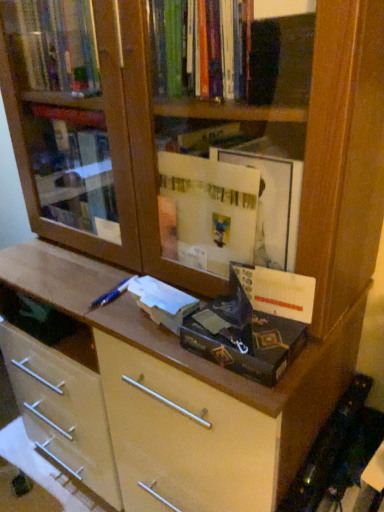
Identify the location of white matte paper at center, which appears as the first paperback book when viewed from the left. (162, 302).

Consider the image. What is the approximate height of white matte paper at center, the second paperback book positioned from the right?

white matte paper at center, the second paperback book positioned from the right, is 2.86 inches tall.

What do you see at coordinates (162, 302) in the screenshot? The image size is (384, 512). I see `white matte paper at center, the second paperback book positioned from the right` at bounding box center [162, 302].

This screenshot has width=384, height=512. What do you see at coordinates (249, 327) in the screenshot?
I see `matte cardboard paperback book at center, the 2th paperback book viewed from the left` at bounding box center [249, 327].

Where is `matte cardboard paperback book at center, the 2th paperback book viewed from the left`? The width and height of the screenshot is (384, 512). matte cardboard paperback book at center, the 2th paperback book viewed from the left is located at coordinates (249, 327).

Measure the distance between point (297,325) and camera.

Point (297,325) is 31.22 inches away from camera.

Locate an element on the screen. white matte paper at center, which appears as the first paperback book when viewed from the left is located at coordinates point(162,302).

Between white matte paper at center, which appears as the first paperback book when viewed from the left, and matte cardboard paperback book at center, arranged as the 1th paperback book when viewed from the right, which one appears on the left side from the viewer's perspective?

Positioned to the left is white matte paper at center, which appears as the first paperback book when viewed from the left.

Which object is further away from the camera, white matte paper at center, the second paperback book positioned from the right, or matte cardboard paperback book at center, the 2th paperback book viewed from the left?

white matte paper at center, the second paperback book positioned from the right, is more distant.

Which is less distant, (152, 290) or (233, 339)?

The point (233, 339) is more forward.

From the image's perspective, is white matte paper at center, which appears as the first paperback book when viewed from the left, located above or below matte cardboard paperback book at center, arranged as the 1th paperback book when viewed from the right?

white matte paper at center, which appears as the first paperback book when viewed from the left, is below matte cardboard paperback book at center, arranged as the 1th paperback book when viewed from the right.

From a real-world perspective, which object stands above the other?

matte cardboard paperback book at center, the 2th paperback book viewed from the left, from a real-world perspective.

Does white matte paper at center, which appears as the first paperback book when viewed from the left, have a greater width compared to matte cardboard paperback book at center, arranged as the 1th paperback book when viewed from the right?

Incorrect, the width of white matte paper at center, which appears as the first paperback book when viewed from the left, does not surpass that of matte cardboard paperback book at center, arranged as the 1th paperback book when viewed from the right.

Considering the relative sizes of white matte paper at center, the second paperback book positioned from the right, and matte cardboard paperback book at center, arranged as the 1th paperback book when viewed from the right, in the image provided, is white matte paper at center, the second paperback book positioned from the right, shorter than matte cardboard paperback book at center, arranged as the 1th paperback book when viewed from the right,?

Correct, white matte paper at center, the second paperback book positioned from the right, is not as tall as matte cardboard paperback book at center, arranged as the 1th paperback book when viewed from the right.

Considering the sizes of objects white matte paper at center, which appears as the first paperback book when viewed from the left, and matte cardboard paperback book at center, arranged as the 1th paperback book when viewed from the right, in the image provided, who is smaller, white matte paper at center, which appears as the first paperback book when viewed from the left, or matte cardboard paperback book at center, arranged as the 1th paperback book when viewed from the right,?

Smaller between the two is white matte paper at center, which appears as the first paperback book when viewed from the left.

Could matte cardboard paperback book at center, the 2th paperback book viewed from the left, be considered to be inside white matte paper at center, which appears as the first paperback book when viewed from the left?

No, matte cardboard paperback book at center, the 2th paperback book viewed from the left, is located outside of white matte paper at center, which appears as the first paperback book when viewed from the left.

Is white matte paper at center, which appears as the first paperback book when viewed from the left, far away from matte cardboard paperback book at center, the 2th paperback book viewed from the left?

Actually, white matte paper at center, which appears as the first paperback book when viewed from the left, and matte cardboard paperback book at center, the 2th paperback book viewed from the left, are a little close together.

Is white matte paper at center, the second paperback book positioned from the right, looking in the opposite direction of matte cardboard paperback book at center, arranged as the 1th paperback book when viewed from the right?

No, white matte paper at center, the second paperback book positioned from the right, is not facing away from matte cardboard paperback book at center, arranged as the 1th paperback book when viewed from the right.

How different are the orientations of white matte paper at center, which appears as the first paperback book when viewed from the left, and matte cardboard paperback book at center, the 2th paperback book viewed from the left, in degrees?

The angular difference between white matte paper at center, which appears as the first paperback book when viewed from the left, and matte cardboard paperback book at center, the 2th paperback book viewed from the left, is 15.8 degrees.

Locate an element on the screen. Image resolution: width=384 pixels, height=512 pixels. paperback book that is on the left side of matte cardboard paperback book at center, the 2th paperback book viewed from the left is located at coordinates (162, 302).

Can you confirm if matte cardboard paperback book at center, arranged as the 1th paperback book when viewed from the right, is positioned to the left of white matte paper at center, which appears as the first paperback book when viewed from the left?

In fact, matte cardboard paperback book at center, arranged as the 1th paperback book when viewed from the right, is to the right of white matte paper at center, which appears as the first paperback book when viewed from the left.

Is the position of matte cardboard paperback book at center, arranged as the 1th paperback book when viewed from the right, more distant than that of white matte paper at center, which appears as the first paperback book when viewed from the left?

No, it is not.

Which is farther, (231, 265) or (164, 284)?

The point (164, 284) is behind.

From the image's perspective, which one is positioned higher, matte cardboard paperback book at center, arranged as the 1th paperback book when viewed from the right, or white matte paper at center, the second paperback book positioned from the right?

From the image's view, matte cardboard paperback book at center, arranged as the 1th paperback book when viewed from the right, is above.

From a real-world perspective, who is located higher, matte cardboard paperback book at center, the 2th paperback book viewed from the left, or white matte paper at center, which appears as the first paperback book when viewed from the left?

matte cardboard paperback book at center, the 2th paperback book viewed from the left.

Considering the sizes of matte cardboard paperback book at center, the 2th paperback book viewed from the left, and white matte paper at center, which appears as the first paperback book when viewed from the left, in the image, is matte cardboard paperback book at center, the 2th paperback book viewed from the left, wider or thinner than white matte paper at center, which appears as the first paperback book when viewed from the left,?

In the image, matte cardboard paperback book at center, the 2th paperback book viewed from the left, appears to be wider than white matte paper at center, which appears as the first paperback book when viewed from the left.

Considering the sizes of objects matte cardboard paperback book at center, the 2th paperback book viewed from the left, and white matte paper at center, the second paperback book positioned from the right, in the image provided, who is taller, matte cardboard paperback book at center, the 2th paperback book viewed from the left, or white matte paper at center, the second paperback book positioned from the right,?

matte cardboard paperback book at center, the 2th paperback book viewed from the left.

Does matte cardboard paperback book at center, the 2th paperback book viewed from the left, have a larger size compared to white matte paper at center, which appears as the first paperback book when viewed from the left?

A: Correct, matte cardboard paperback book at center, the 2th paperback book viewed from the left, is larger in size than white matte paper at center, which appears as the first paperback book when viewed from the left.

Is white matte paper at center, the second paperback book positioned from the right, a part of matte cardboard paperback book at center, the 2th paperback book viewed from the left?

Actually, white matte paper at center, the second paperback book positioned from the right, is outside matte cardboard paperback book at center, the 2th paperback book viewed from the left.

Is matte cardboard paperback book at center, the 2th paperback book viewed from the left, next to white matte paper at center, the second paperback book positioned from the right?

No, matte cardboard paperback book at center, the 2th paperback book viewed from the left, is not in contact with white matte paper at center, the second paperback book positioned from the right.

Is matte cardboard paperback book at center, arranged as the 1th paperback book when viewed from the right, facing away from white matte paper at center, the second paperback book positioned from the right?

No.

Measure the distance between matte cardboard paperback book at center, the 2th paperback book viewed from the left, and white matte paper at center, which appears as the first paperback book when viewed from the left.

matte cardboard paperback book at center, the 2th paperback book viewed from the left, is 4.44 inches away from white matte paper at center, which appears as the first paperback book when viewed from the left.

I want to click on paperback book below the matte cardboard paperback book at center, the 2th paperback book viewed from the left (from a real-world perspective), so click(x=162, y=302).

Locate an element on the screen. paperback book beneath the matte cardboard paperback book at center, the 2th paperback book viewed from the left (from a real-world perspective) is located at coordinates (162, 302).

Identify the location of paperback book behind the matte cardboard paperback book at center, the 2th paperback book viewed from the left. point(162,302).